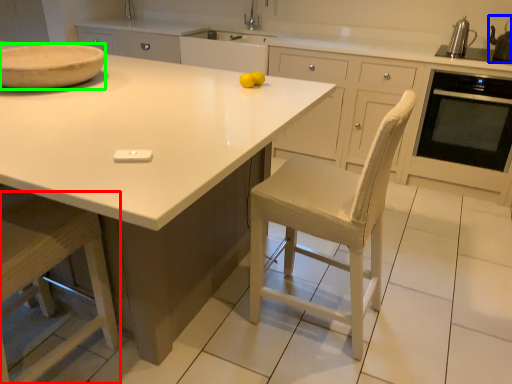
Question: Which object is the farthest from step stool (highlighted by a red box)? Choose among these: appliance (highlighted by a blue box) or bowl (highlighted by a green box).

Choices:
 (A) appliance
 (B) bowl

Answer: (A)